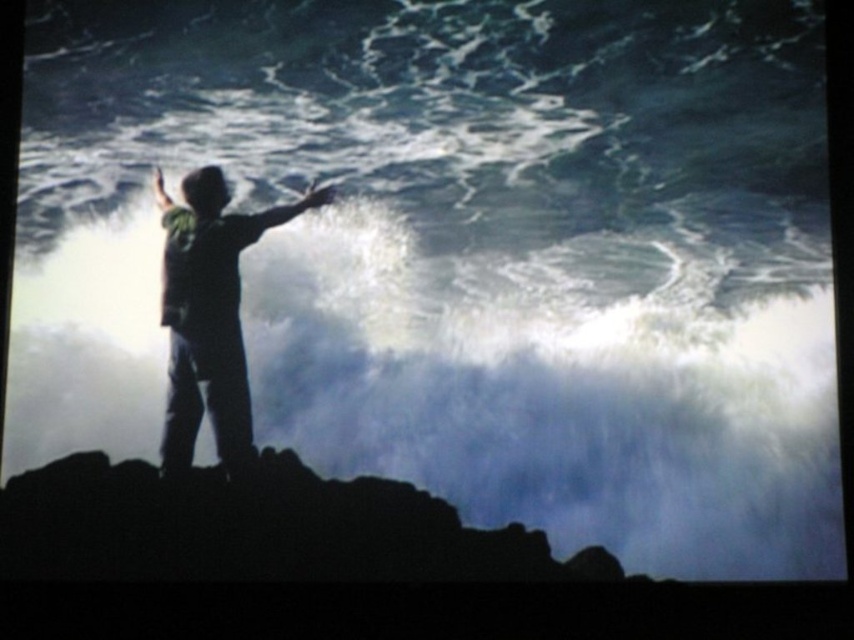
Which is below, silhouette clothing at center or silvery metallic arm at center?

silhouette clothing at center

Does point (196, 360) lie behind point (249, 221)?

No, (196, 360) is closer to viewer.

This screenshot has height=640, width=854. In order to click on silhouette clothing at center in this screenshot , I will do `click(209, 317)`.

Does silvery metallic arm at center have a smaller size compared to matte green shirt at center?

Incorrect, silvery metallic arm at center is not smaller in size than matte green shirt at center.

Is point (311, 198) closer to viewer compared to point (161, 177)?

No, (311, 198) is further to viewer.

Image resolution: width=854 pixels, height=640 pixels. I want to click on silvery metallic arm at center, so click(273, 216).

Where is `silvery metallic arm at center`? silvery metallic arm at center is located at coordinates (273, 216).

Which is more to the right, silhouette clothing at center or matte green shirt at center?

silhouette clothing at center is more to the right.

Does silhouette clothing at center appear on the left side of matte green shirt at center?

Incorrect, silhouette clothing at center is not on the left side of matte green shirt at center.

Where is `silhouette clothing at center`? This screenshot has width=854, height=640. silhouette clothing at center is located at coordinates (209, 317).